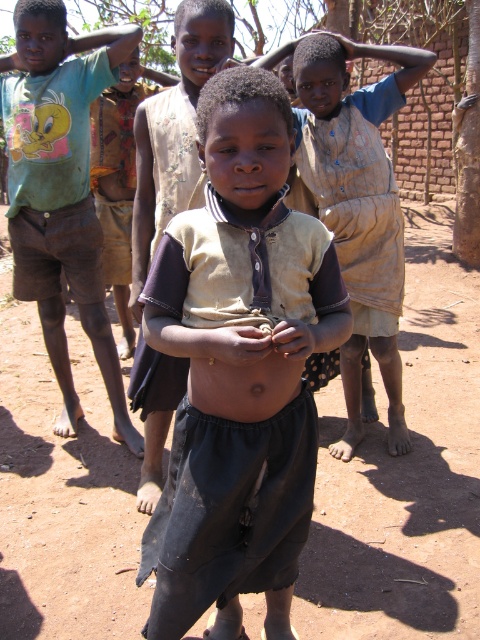
You are a photographer trying to capture the scene from the front. You notice the dirt field at center and the dirty beige shirt at center. Which object is positioned to the right of the other?

The dirt field at center is to the right of the dirty beige shirt at center.